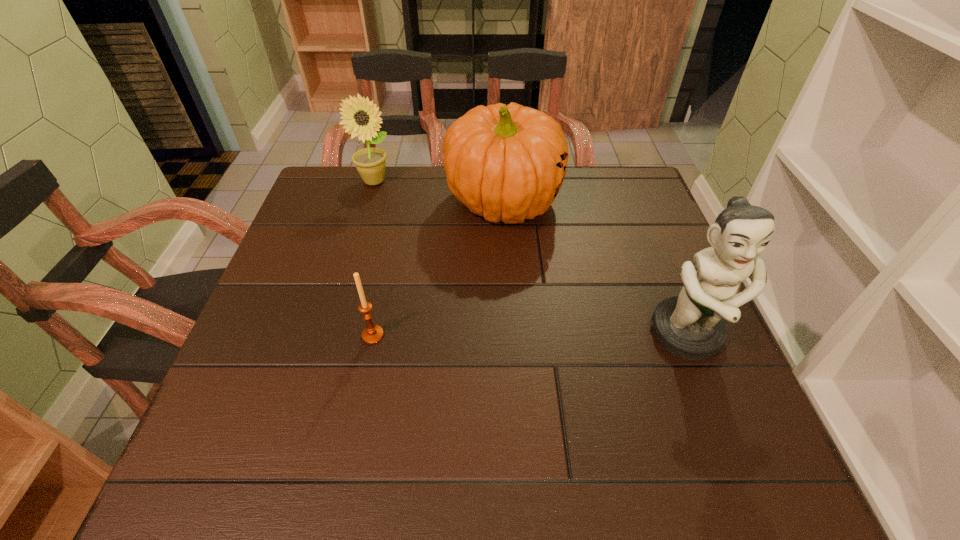
Find the location of `free space at the left edge of the desktop`. free space at the left edge of the desktop is located at coordinates pyautogui.click(x=333, y=292).

Image resolution: width=960 pixels, height=540 pixels. Find the location of `blank space at the right edge`. blank space at the right edge is located at coordinates (679, 368).

Locate an element on the screen. free point at the far left corner is located at coordinates (348, 187).

At what (x,y) coordinates should I click in order to perform the action: click on free space at the near left corner. Please return your answer as a coordinate pair (x, y). The width and height of the screenshot is (960, 540). Looking at the image, I should click on (219, 412).

Identify the location of vacant region at the far right corner of the desktop. This screenshot has width=960, height=540. (609, 166).

Find the location of a particular element. Image resolution: width=960 pixels, height=540 pixels. vacant point located between the shortest object and the figurine is located at coordinates (530, 335).

The image size is (960, 540). What are the coordinates of `vacant area that lies between the figurine and the leftmost object` in the screenshot? It's located at (531, 259).

This screenshot has width=960, height=540. Identify the location of free space between the candle_holder and the third object from left to right. (438, 268).

Where is `vacant area between the leftmost object and the shortest object`? Image resolution: width=960 pixels, height=540 pixels. vacant area between the leftmost object and the shortest object is located at coordinates (373, 258).

I want to click on vacant space that's between the pumpkin and the leftmost object, so pyautogui.click(x=439, y=192).